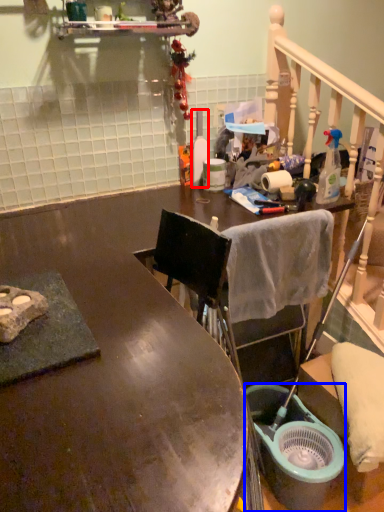
Question: Which point is closer to the camera, bottle (highlighted by a red box) or bucket (highlighted by a blue box)?

Choices:
 (A) bottle
 (B) bucket

Answer: (B)